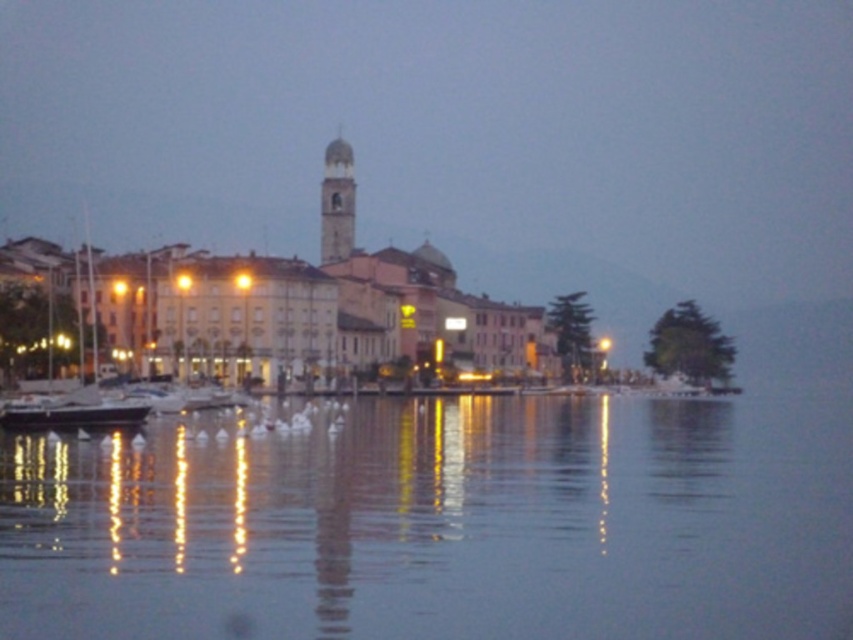
Question: Considering the real-world distances, which object is closest to the black matte boat at lower left?

Choices:
 (A) transparent water at center
 (B) white matte sailboat at left
 (C) smooth stone bell tower at center

Answer: (B)

Question: Is white matte sailboat at left to the left of black matte boat at lower left from the viewer's perspective?

Choices:
 (A) yes
 (B) no

Answer: (A)

Question: From the image, what is the correct spatial relationship of white matte sailboat at left in relation to smooth stone bell tower at center?

Choices:
 (A) right
 (B) left

Answer: (B)

Question: Considering the real-world distances, which object is farthest from the transparent water at center?

Choices:
 (A) smooth stone bell tower at center
 (B) white matte sailboat at left

Answer: (A)

Question: Is transparent water at center to the right of white matte sailboat at left from the viewer's perspective?

Choices:
 (A) no
 (B) yes

Answer: (B)

Question: Which point is farther to the camera?

Choices:
 (A) (331, 241)
 (B) (90, 288)
 (C) (141, 417)

Answer: (A)